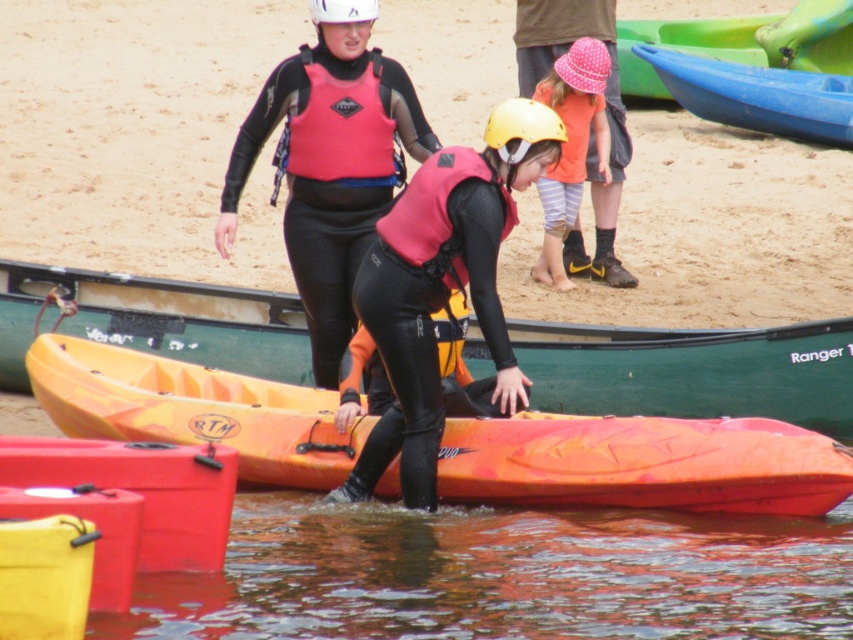
Question: Is pink matte life vest at center bigger than matte pink life vest at center?

Choices:
 (A) yes
 (B) no

Answer: (B)

Question: Estimate the real-world distances between objects in this image. Which object is closer to the brown murky water at lower center?

Choices:
 (A) orange plastic canoe at center
 (B) matte orange canoe at lower left

Answer: (B)

Question: Which point is closer to the camera?

Choices:
 (A) orange plastic canoe at center
 (B) matte pink life vest at center

Answer: (A)

Question: Considering the real-world distances, which object is farthest from the matte pink life vest at center?

Choices:
 (A) white matte helmet at upper center
 (B) pink matte life vest at center

Answer: (B)

Question: Is pink matte life vest at center thinner than orange cotton shirt at center?

Choices:
 (A) yes
 (B) no

Answer: (B)

Question: Does pink matte life vest at center appear over matte pink life vest at center?

Choices:
 (A) no
 (B) yes

Answer: (A)